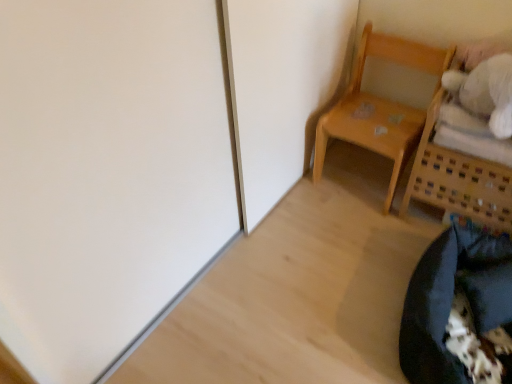
The height and width of the screenshot is (384, 512). What are the coordinates of `free point to the left of black fabric bean bag chair at lower right` in the screenshot? It's located at click(x=328, y=304).